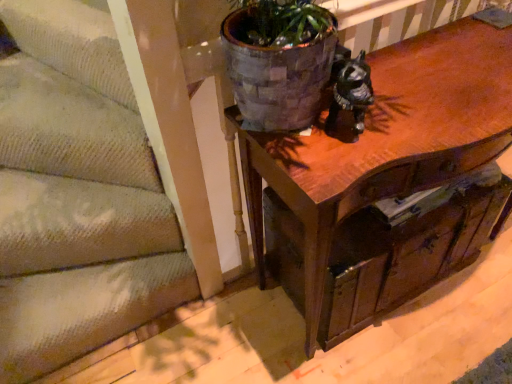
Question: Is wooden table at center in contact with textured beige carpet at lower left?

Choices:
 (A) no
 (B) yes

Answer: (A)

Question: Does wooden table at center have a smaller size compared to textured beige carpet at lower left?

Choices:
 (A) no
 (B) yes

Answer: (A)

Question: Is wooden table at center thinner than textured beige carpet at lower left?

Choices:
 (A) no
 (B) yes

Answer: (B)

Question: Does wooden table at center have a greater height compared to textured beige carpet at lower left?

Choices:
 (A) no
 (B) yes

Answer: (B)

Question: Is wooden table at center positioned in front of textured beige carpet at lower left?

Choices:
 (A) no
 (B) yes

Answer: (B)

Question: Is wooden table at center inside the boundaries of textured beige carpet at lower left, or outside?

Choices:
 (A) inside
 (B) outside

Answer: (B)

Question: Is wooden table at center to the left or to the right of textured beige carpet at lower left in the image?

Choices:
 (A) right
 (B) left

Answer: (A)

Question: Is point (497, 39) closer or farther from the camera than point (31, 286)?

Choices:
 (A) farther
 (B) closer

Answer: (B)

Question: Considering the positions of wooden table at center and textured beige carpet at lower left in the image, is wooden table at center taller or shorter than textured beige carpet at lower left?

Choices:
 (A) tall
 (B) short

Answer: (A)

Question: In the image, is textured beige carpet at lower left positioned in front of or behind wooden drawer at center?

Choices:
 (A) behind
 (B) front

Answer: (A)

Question: From a real-world perspective, relative to wooden drawer at center, is textured beige carpet at lower left vertically above or below?

Choices:
 (A) below
 (B) above

Answer: (A)

Question: Considering the positions of point (96, 244) and point (349, 218), is point (96, 244) closer or farther from the camera than point (349, 218)?

Choices:
 (A) closer
 (B) farther

Answer: (B)

Question: In terms of size, does textured beige carpet at lower left appear bigger or smaller than wooden drawer at center?

Choices:
 (A) big
 (B) small

Answer: (B)

Question: From a real-world perspective, relative to wooden table at center, is wooden drawer at center vertically above or below?

Choices:
 (A) below
 (B) above

Answer: (A)

Question: Based on their positions, is wooden drawer at center located to the left or right of wooden table at center?

Choices:
 (A) right
 (B) left

Answer: (B)